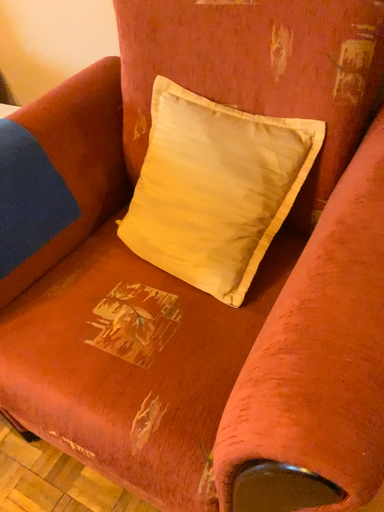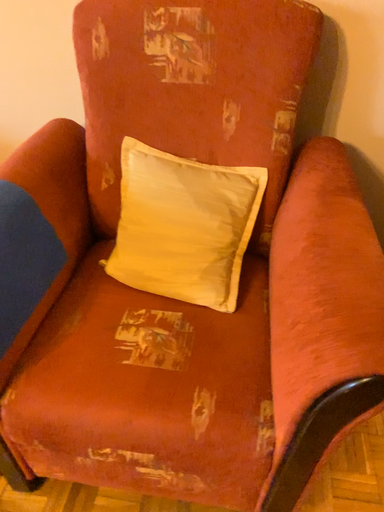
Question: Which way did the camera rotate in the video?

Choices:
 (A) rotated upward
 (B) rotated downward

Answer: (A)